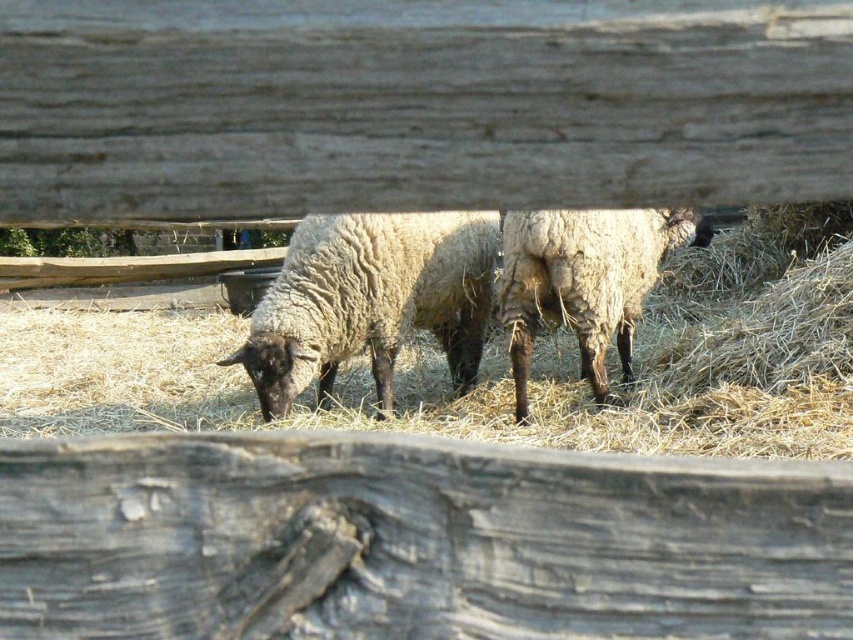
You are a farmer checking the enclosure. You notice the light brown straw at center and the fuzzy woolly sheep at center. Which object is closer to the ground?

The light brown straw at center is positioned under the fuzzy woolly sheep at center, so the light brown straw at center is closer to the ground.

You are standing at the point marked as point (473, 390) in the image. What is directly beneath your feet?

The point (473, 390) is on light brown straw at center, so the light brown straw at center is directly beneath your feet.

You are a farmer checking the enclosure. You need to ensure there is enough space between the light brown straw at center and the fuzzy white sheep at center for a 12 inch wide feeding trough. Can the trough fit between them?

The distance between the light brown straw at center and the fuzzy white sheep at center is 14.56 inches, which is wider than the 12 inch trough. Therefore, the trough can fit between them.